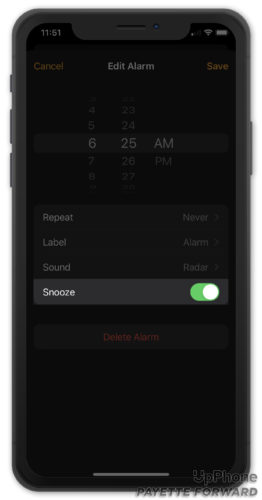
Where is `"delete alarm" button`? "delete alarm" button is located at coordinates (137, 341).